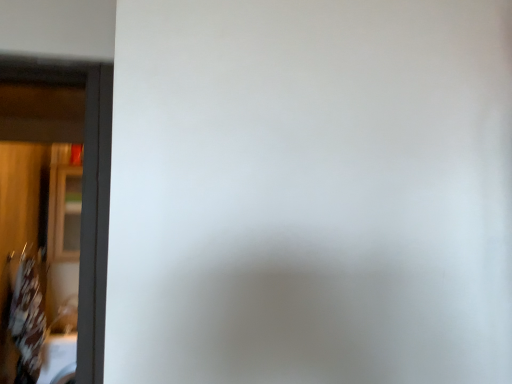
Where is `clear glass shelf at left`? The width and height of the screenshot is (512, 384). clear glass shelf at left is located at coordinates (64, 213).

What do you see at coordinates (64, 213) in the screenshot? The width and height of the screenshot is (512, 384). I see `clear glass shelf at left` at bounding box center [64, 213].

This screenshot has width=512, height=384. In order to click on clear glass shelf at left in this screenshot , I will do `click(64, 213)`.